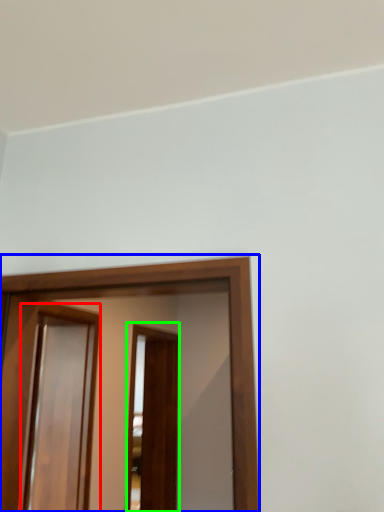
Question: Which object is the farthest from screen door (highlighted by a red box)? Choose among these: screen door (highlighted by a blue box) or screen door (highlighted by a green box).

Choices:
 (A) screen door
 (B) screen door

Answer: (B)